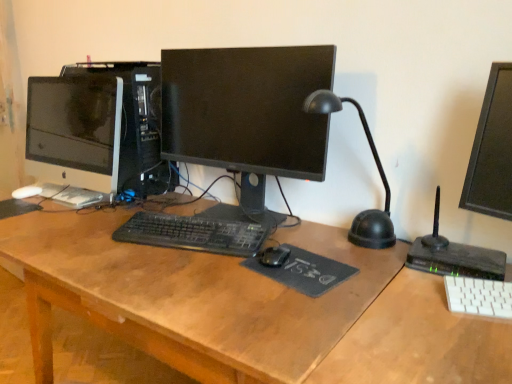
You are a GUI agent. You are given a task and a screenshot of the screen. Output one action in this format:
    pyautogui.click(x=<x>, y=<y>)
    Task: Click on the free space in front of black glossy monitor at center, the 1th computer monitor viewed from the right
    The image size is (512, 384).
    Given the screenshot: What is the action you would take?
    pyautogui.click(x=245, y=281)